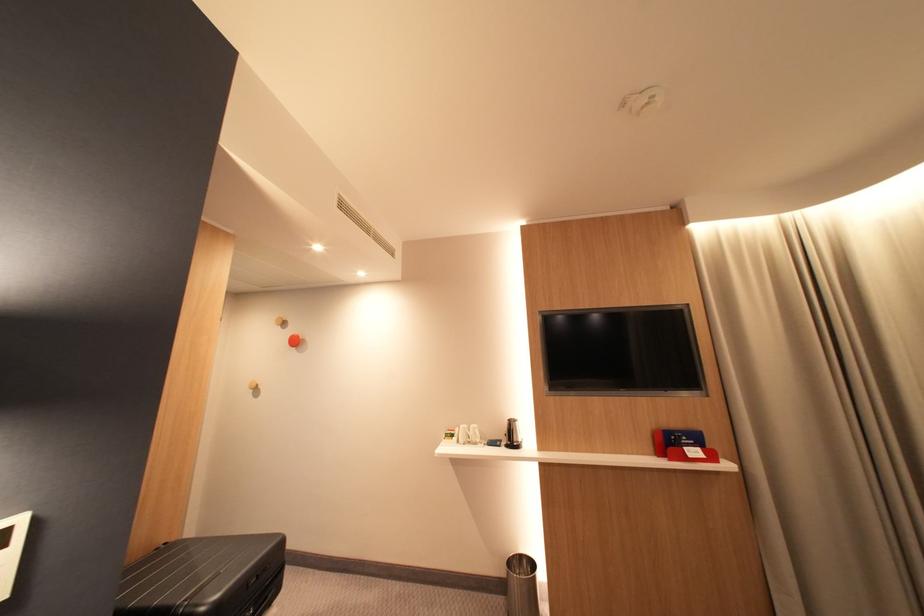
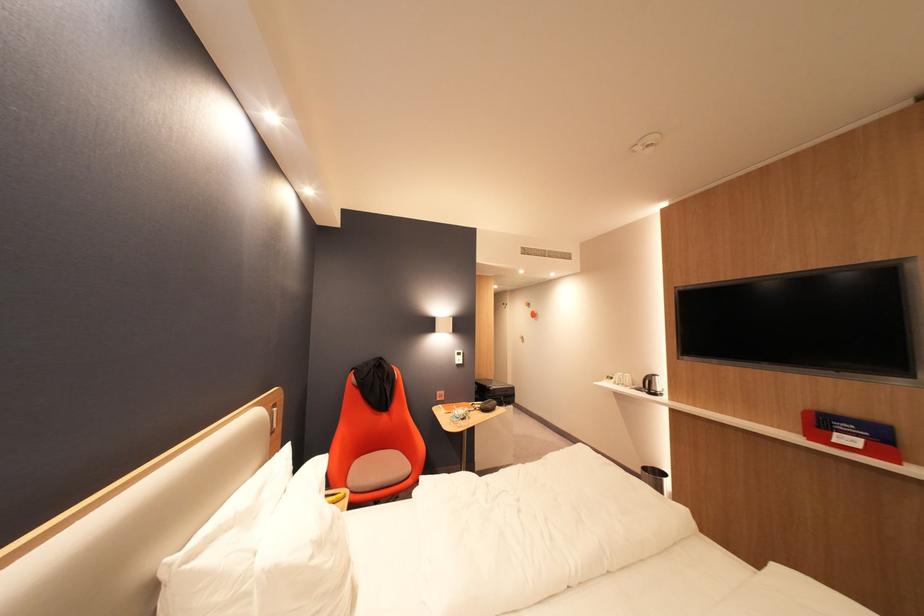
Where in the second image is the point corresponding to (x=696, y=450) from the first image?

(846, 435)